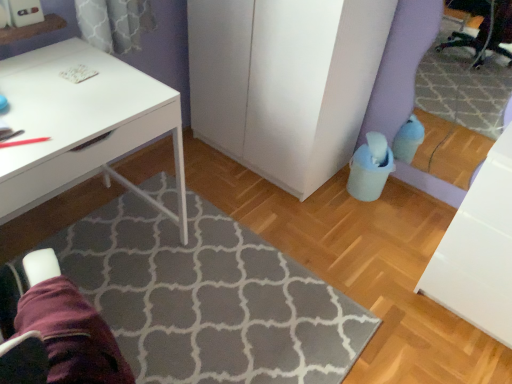
This screenshot has width=512, height=384. Identify the location of vacant space in between white glossy file cabinet at lower right and gray textured rug at center. (362, 273).